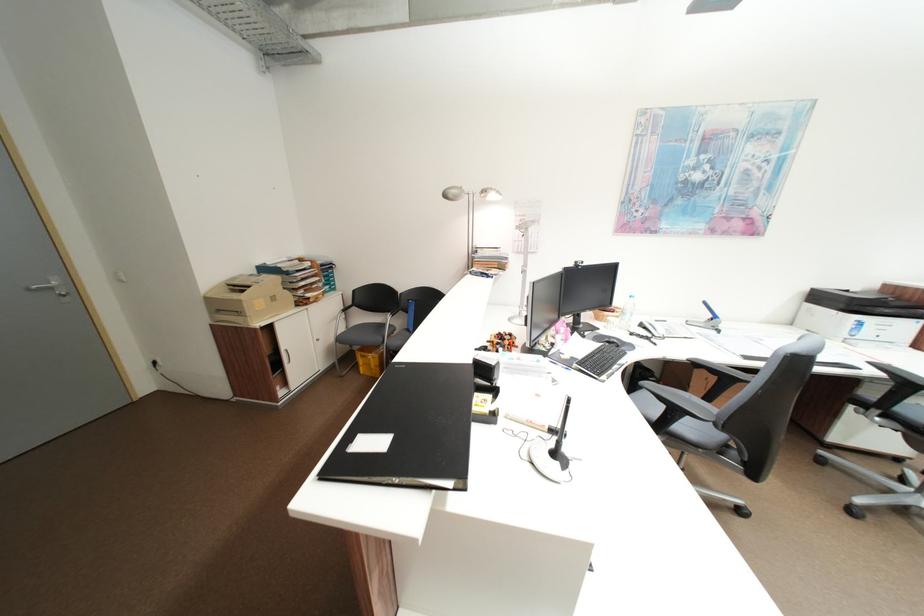
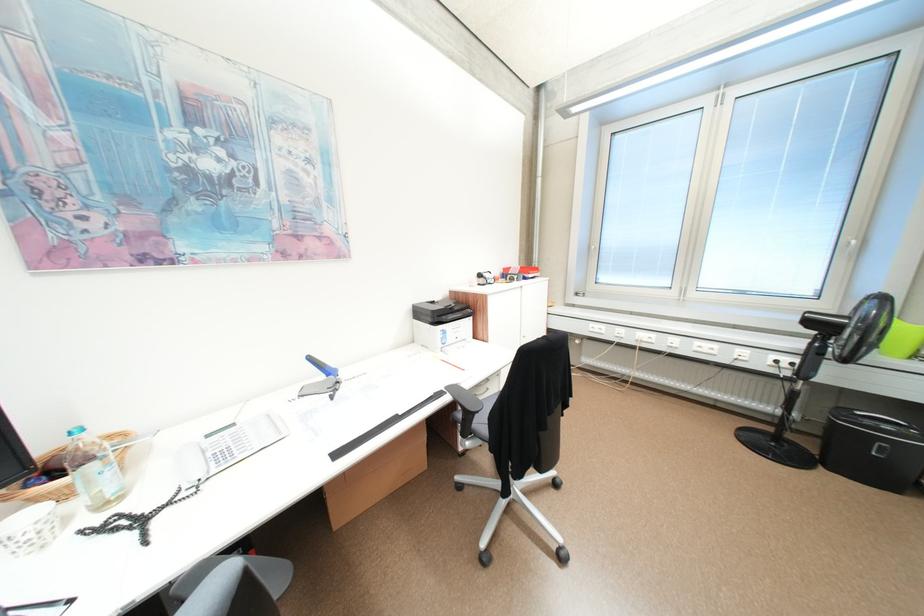
In the second image, find the point that corresponds to pixel 829 298 in the first image.

(428, 313)